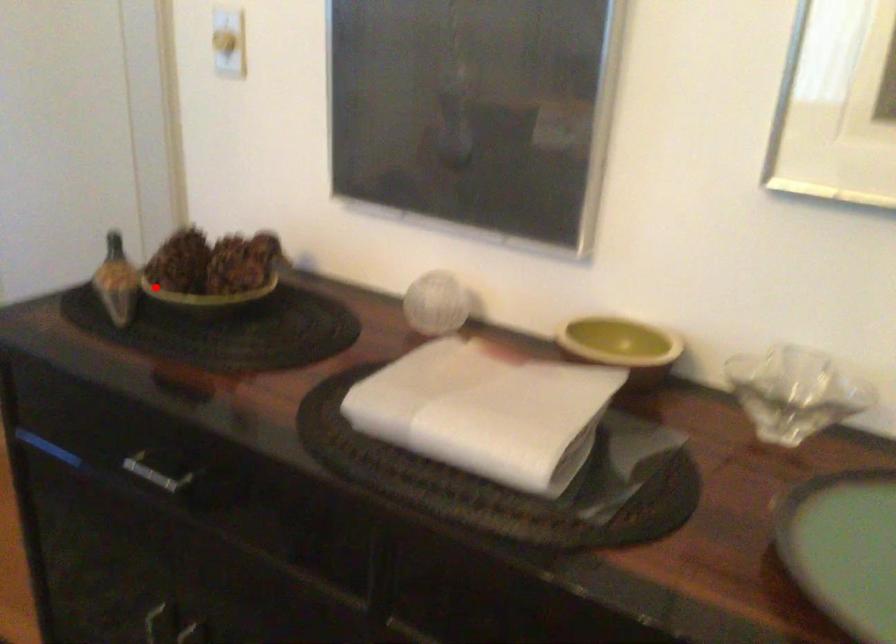
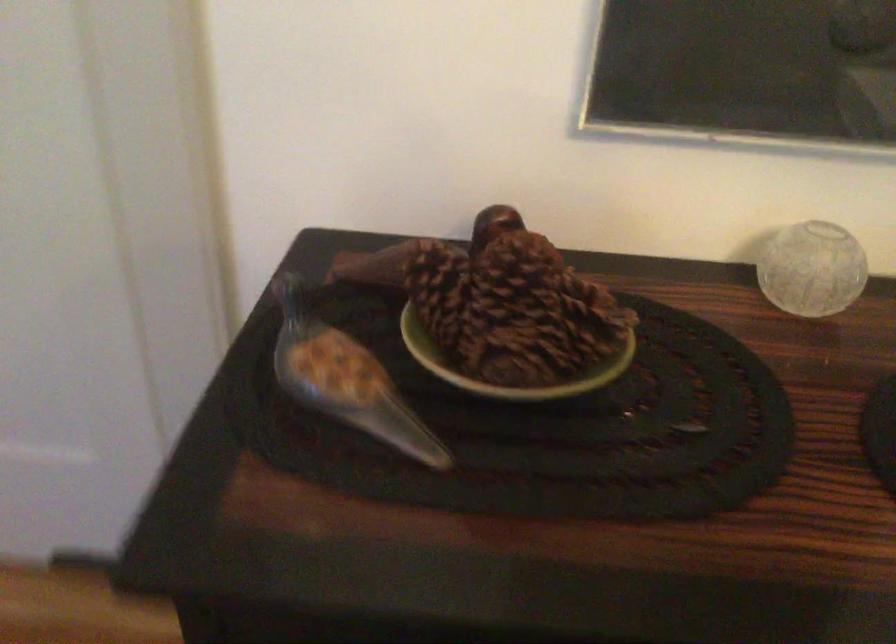
The point at the highlighted location is marked in the first image. Where is the corresponding point in the second image?

(506, 366)